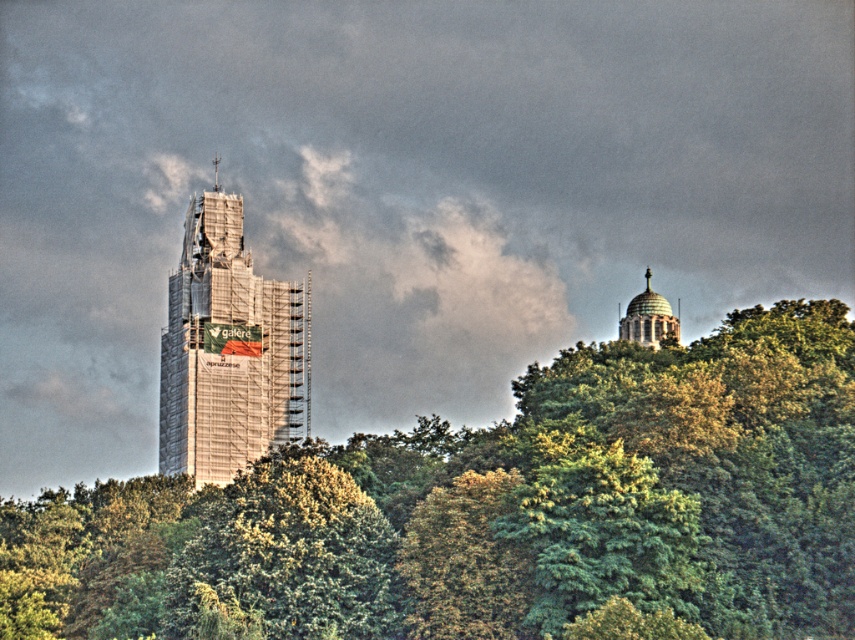
Is point (187, 593) less distant than point (205, 337)?

That is True.

Is green leafy tree at center above scaffolding metal tower at center?

Actually, green leafy tree at center is below scaffolding metal tower at center.

The height and width of the screenshot is (640, 855). What do you see at coordinates (496, 509) in the screenshot?
I see `green leafy tree at center` at bounding box center [496, 509].

The image size is (855, 640). What are the coordinates of `green leafy tree at center` in the screenshot? It's located at (496, 509).

The height and width of the screenshot is (640, 855). Describe the element at coordinates (228, 349) in the screenshot. I see `scaffolding metal tower at center` at that location.

Between scaffolding metal tower at center and green domed structure at upper right, which one has more height?

scaffolding metal tower at center is taller.

Does point (205, 326) lie behind point (656, 330)?

No, it is in front of (656, 330).

At what (x,y) coordinates should I click in order to perform the action: click on scaffolding metal tower at center. Please return your answer as a coordinate pair (x, y). Looking at the image, I should click on (228, 349).

Which of these two, green leafy tree at center or green domed structure at upper right, stands shorter?

Standing shorter between the two is green domed structure at upper right.

Is point (431, 520) positioned in front of point (635, 308)?

Yes, it is.

Who is more forward, (687, 445) or (663, 333)?

Point (687, 445)

At what (x,y) coordinates should I click in order to perform the action: click on green leafy tree at center. Please return your answer as a coordinate pair (x, y). Looking at the image, I should click on (496, 509).